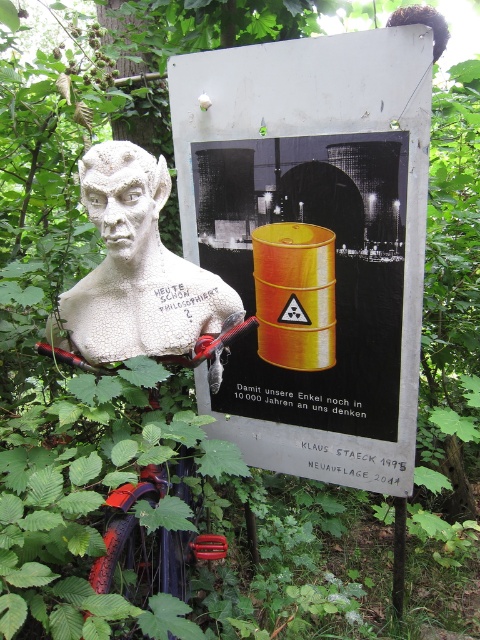
Who is positioned more to the left, metallic yellow barrel at center or white textured bust at left?

white textured bust at left

You are a GUI agent. You are given a task and a screenshot of the screen. Output one action in this format:
    pyautogui.click(x=<x>, y=<y>)
    Task: Click on the metallic yellow barrel at center
    
    Given the screenshot: What is the action you would take?
    pyautogui.click(x=314, y=228)